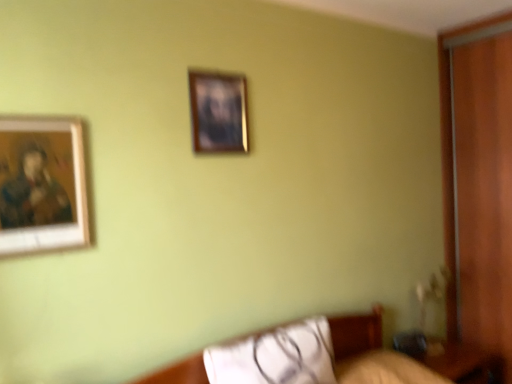
Describe the element at coordinates (452, 358) in the screenshot. Image resolution: width=512 pixels, height=384 pixels. I see `wooden table at lower right` at that location.

Describe the element at coordinates (276, 357) in the screenshot. This screenshot has width=512, height=384. I see `white fabric pillow at lower center` at that location.

In order to face wooden-framed painting at left, which appears as the second picture frame when viewed from the right, should I rotate leftwards or rightwards?

You should rotate left by 25.810 degrees.

Find the location of a particular element. Image resolution: width=512 pixels, height=384 pixels. wooden frame at upper center, marked as the 2th picture frame in a left-to-right arrangement is located at coordinates (218, 112).

Based on the photo, can you tell me how much wooden table at lower right and wooden frame at upper center, arranged as the second picture frame when ordered from the bottom, differ in facing direction?

They differ by 0.442 degrees in their facing directions.

Is wooden table at lower right positioned far away from wooden frame at upper center, arranged as the second picture frame when ordered from the bottom?

Yes.

Considering the sizes of objects wooden table at lower right and wooden frame at upper center, arranged as the first picture frame when viewed from the back, in the image provided, who is taller, wooden table at lower right or wooden frame at upper center, arranged as the first picture frame when viewed from the back,?

Standing taller between the two is wooden frame at upper center, arranged as the first picture frame when viewed from the back.

Is wooden table at lower right situated inside wooden-framed painting at left, which is the 1th picture frame in bottom-to-top order, or outside?

→ wooden table at lower right cannot be found inside wooden-framed painting at left, which is the 1th picture frame in bottom-to-top order.

From a real-world perspective, is wooden table at lower right on top of wooden-framed painting at left, acting as the 2th picture frame starting from the back?

No, from a real-world perspective, wooden table at lower right is not on top of wooden-framed painting at left, acting as the 2th picture frame starting from the back.

From a real-world perspective, count 1st picture frames upward from the wooden table at lower right and point to it. Please provide its 2D coordinates.

[(42, 185)]

Would you say wooden table at lower right is a long distance from wooden-framed painting at left, which is the 1th picture frame in bottom-to-top order?

Yes.

Looking at this image, is the surface of wooden frame at upper center, arranged as the first picture frame when viewed from the back, in direct contact with wooden-framed painting at left, which appears as the second picture frame when viewed from the right?

wooden frame at upper center, arranged as the first picture frame when viewed from the back, and wooden-framed painting at left, which appears as the second picture frame when viewed from the right, are clearly separated.

Between wooden frame at upper center, arranged as the second picture frame when ordered from the bottom, and wooden-framed painting at left, which is the 1th picture frame in bottom-to-top order, which one appears on the left side from the viewer's perspective?

wooden-framed painting at left, which is the 1th picture frame in bottom-to-top order, is more to the left.

In the scene shown: Is wooden frame at upper center, which is the first picture frame from top to bottom, situated inside wooden-framed painting at left, which is the 1th picture frame in bottom-to-top order, or outside?

wooden frame at upper center, which is the first picture frame from top to bottom, is located beyond the bounds of wooden-framed painting at left, which is the 1th picture frame in bottom-to-top order.

How many degrees apart are the facing directions of wooden frame at upper center, marked as the 2th picture frame in a left-to-right arrangement, and wooden-framed painting at left, which is the 1th picture frame in bottom-to-top order?

wooden frame at upper center, marked as the 2th picture frame in a left-to-right arrangement, and wooden-framed painting at left, which is the 1th picture frame in bottom-to-top order, are facing 0.351 degrees away from each other.

Can you confirm if wooden-framed painting at left, marked as the first picture frame in a left-to-right arrangement, is smaller than white fabric pillow at lower center?

Correct, wooden-framed painting at left, marked as the first picture frame in a left-to-right arrangement, occupies less space than white fabric pillow at lower center.

Looking at this image, does wooden-framed painting at left, marked as the first picture frame in a left-to-right arrangement, lie behind white fabric pillow at lower center?

No, the depth of wooden-framed painting at left, marked as the first picture frame in a left-to-right arrangement, is less than that of white fabric pillow at lower center.

At what (x,y) coordinates should I click in order to perform the action: click on pillow below the wooden-framed painting at left, which is the 1th picture frame in bottom-to-top order (from a real-world perspective). Please return your answer as a coordinate pair (x, y). This screenshot has height=384, width=512. Looking at the image, I should click on (276, 357).

In terms of width, does wooden-framed painting at left, acting as the 2th picture frame starting from the back, look wider or thinner when compared to wooden frame at upper center, arranged as the first picture frame when viewed from the back?

In the image, wooden-framed painting at left, acting as the 2th picture frame starting from the back, appears to be wider than wooden frame at upper center, arranged as the first picture frame when viewed from the back.

Locate an element on the screen. The width and height of the screenshot is (512, 384). picture frame in front of the wooden frame at upper center, marked as the 2th picture frame in a left-to-right arrangement is located at coordinates (42, 185).

Looking at this image, between wooden-framed painting at left, marked as the first picture frame in a left-to-right arrangement, and wooden frame at upper center, the second picture frame from the front, which one has less height?

wooden frame at upper center, the second picture frame from the front.

Is wooden frame at upper center, which appears as the 1th picture frame when viewed from the right, taller or shorter than white fabric pillow at lower center?

Clearly, wooden frame at upper center, which appears as the 1th picture frame when viewed from the right, is taller compared to white fabric pillow at lower center.

Considering the positions of objects wooden frame at upper center, which appears as the 1th picture frame when viewed from the right, and white fabric pillow at lower center in the image provided, who is in front, wooden frame at upper center, which appears as the 1th picture frame when viewed from the right, or white fabric pillow at lower center?

white fabric pillow at lower center.

Is wooden frame at upper center, marked as the 2th picture frame in a left-to-right arrangement, not close to white fabric pillow at lower center?

Absolutely, wooden frame at upper center, marked as the 2th picture frame in a left-to-right arrangement, is distant from white fabric pillow at lower center.

How many degrees apart are the facing directions of wooden frame at upper center, the second picture frame from the front, and white fabric pillow at lower center?

The angular difference between wooden frame at upper center, the second picture frame from the front, and white fabric pillow at lower center is 0.834 degrees.

Considering the relative positions of wooden table at lower right and white fabric pillow at lower center in the image provided, is wooden table at lower right in front of white fabric pillow at lower center?

That is False.

Considering the sizes of wooden table at lower right and white fabric pillow at lower center in the image, is wooden table at lower right taller or shorter than white fabric pillow at lower center?

wooden table at lower right is taller than white fabric pillow at lower center.

Considering the sizes of objects wooden table at lower right and white fabric pillow at lower center in the image provided, who is thinner, wooden table at lower right or white fabric pillow at lower center?

With smaller width is white fabric pillow at lower center.

Is point (484, 356) in front of point (260, 368)?

No, it is behind (260, 368).

I want to click on the 1st picture frame in front when counting from the wooden table at lower right, so click(218, 112).

Locate an element on the screen. This screenshot has height=384, width=512. the 1st picture frame above the wooden table at lower right (from the image's perspective) is located at coordinates (42, 185).

Considering their positions, is wooden-framed painting at left, which appears as the second picture frame when viewed from the right, positioned closer to white fabric pillow at lower center than wooden frame at upper center, arranged as the second picture frame when ordered from the bottom?

Based on the image, wooden-framed painting at left, which appears as the second picture frame when viewed from the right, appears to be nearer to white fabric pillow at lower center.

When comparing their distances from wooden frame at upper center, the second picture frame from the front, does wooden table at lower right or white fabric pillow at lower center seem further?

wooden table at lower right lies further to wooden frame at upper center, the second picture frame from the front, than the other object.

Which object lies further to the anchor point wooden table at lower right, wooden frame at upper center, which is the first picture frame from top to bottom, or white fabric pillow at lower center?

wooden frame at upper center, which is the first picture frame from top to bottom, lies further to wooden table at lower right than the other object.

Looking at the image, which one is located closer to wooden-framed painting at left, the 2th picture frame when ordered from top to bottom, wooden frame at upper center, which appears as the 1th picture frame when viewed from the right, or white fabric pillow at lower center?

The object closer to wooden-framed painting at left, the 2th picture frame when ordered from top to bottom, is wooden frame at upper center, which appears as the 1th picture frame when viewed from the right.

Considering their positions, is white fabric pillow at lower center positioned further to wooden-framed painting at left, which appears as the second picture frame when viewed from the right, than wooden frame at upper center, which appears as the 1th picture frame when viewed from the right?

white fabric pillow at lower center lies further to wooden-framed painting at left, which appears as the second picture frame when viewed from the right, than the other object.

Based on their spatial positions, is white fabric pillow at lower center or wooden-framed painting at left, marked as the first picture frame in a left-to-right arrangement, further from wooden table at lower right?

wooden-framed painting at left, marked as the first picture frame in a left-to-right arrangement, is further to wooden table at lower right.

Based on their spatial positions, is wooden table at lower right or wooden frame at upper center, the second picture frame from the front, further from wooden-framed painting at left, which is the 1th picture frame in bottom-to-top order?

wooden table at lower right.

Estimate the real-world distances between objects in this image. Which object is closer to wooden frame at upper center, arranged as the second picture frame when ordered from the bottom, white fabric pillow at lower center or wooden-framed painting at left, placed as the first picture frame when sorted from front to back?

Based on the image, wooden-framed painting at left, placed as the first picture frame when sorted from front to back, appears to be nearer to wooden frame at upper center, arranged as the second picture frame when ordered from the bottom.

What are the coordinates of `pillow between wooden frame at upper center, which appears as the 1th picture frame when viewed from the right, and wooden table at lower right, in the vertical direction` in the screenshot? It's located at (276, 357).

Find the location of a particular element. The width and height of the screenshot is (512, 384). picture frame located between wooden-framed painting at left, marked as the first picture frame in a left-to-right arrangement, and wooden table at lower right in the left-right direction is located at coordinates (218, 112).

I want to click on pillow between wooden-framed painting at left, which appears as the second picture frame when viewed from the right, and wooden table at lower right, in the horizontal direction, so click(276, 357).

The image size is (512, 384). I want to click on picture frame between wooden frame at upper center, arranged as the first picture frame when viewed from the back, and white fabric pillow at lower center in the up-down direction, so click(42, 185).